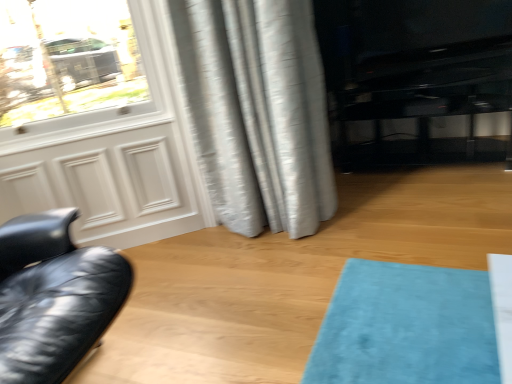
Find the location of a particular element. The height and width of the screenshot is (384, 512). free space above matte white screen door at left (from a real-world perspective) is located at coordinates (74, 131).